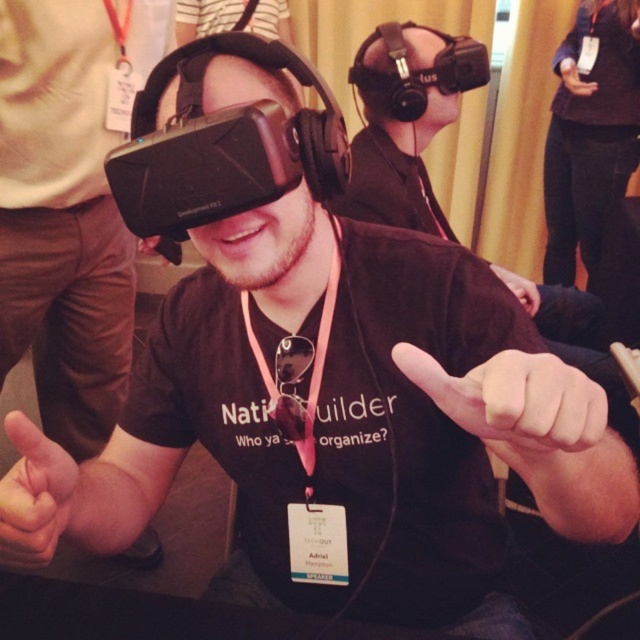
Where is `white matte hand at center`? white matte hand at center is located at coordinates click(515, 401).

This screenshot has width=640, height=640. What do you see at coordinates (515, 401) in the screenshot?
I see `white matte hand at center` at bounding box center [515, 401].

Who is more forward, (541,371) or (10,433)?

Point (541,371) is more forward.

Where is `white matte hand at center`? The image size is (640, 640). white matte hand at center is located at coordinates (515, 401).

Which is more to the left, white matte hand at center or matte black hand at upper right?

white matte hand at center

Between point (548, 374) and point (595, 90), which one is positioned in front?

Point (548, 374) is more forward.

Image resolution: width=640 pixels, height=640 pixels. Identify the location of white matte hand at center. (515, 401).

Can you confirm if white matte hand at center is wider than pink fabric lanyard at center?

Yes, white matte hand at center is wider than pink fabric lanyard at center.

Which is below, white matte hand at center or pink fabric lanyard at center?

white matte hand at center is lower down.

Image resolution: width=640 pixels, height=640 pixels. What do you see at coordinates (515, 401) in the screenshot? I see `white matte hand at center` at bounding box center [515, 401].

Find the location of `white matte hand at center`. white matte hand at center is located at coordinates (515, 401).